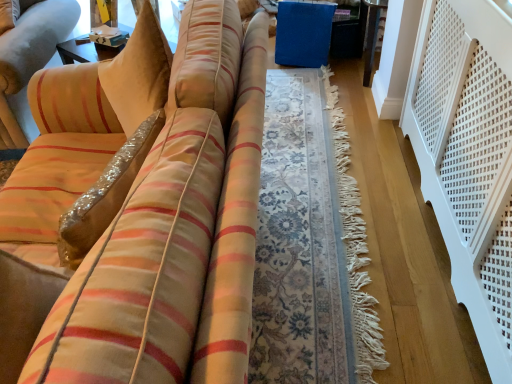
Measure the distance between point (71, 62) and camera.

7.13 feet.

Where is `white cardboard box at upper left`? This screenshot has height=384, width=512. white cardboard box at upper left is located at coordinates (90, 48).

What do you see at coordinates (90, 48) in the screenshot? This screenshot has width=512, height=384. I see `white cardboard box at upper left` at bounding box center [90, 48].

Locate an element on the screen. The height and width of the screenshot is (384, 512). white perforated balustrade at right is located at coordinates (468, 157).

Describe the element at coordinates (468, 157) in the screenshot. I see `white perforated balustrade at right` at that location.

Find the location of `white cardboard box at upper left`. white cardboard box at upper left is located at coordinates (90, 48).

Is white cardboard box at upper left to the left of white perforated balustrade at right from the viewer's perspective?

Correct, you'll find white cardboard box at upper left to the left of white perforated balustrade at right.

Considering the positions of objects white cardboard box at upper left and white perforated balustrade at right in the image provided, who is in front, white cardboard box at upper left or white perforated balustrade at right?

white perforated balustrade at right is more forward.

Between point (63, 58) and point (500, 346), which one is positioned behind?

The point (63, 58) is farther.

From the image's perspective, is white cardboard box at upper left over white perforated balustrade at right?

Yes, from the image's perspective, white cardboard box at upper left is on top of white perforated balustrade at right.

Based on the photo, from a real-world perspective, who is located lower, white cardboard box at upper left or white perforated balustrade at right?

white perforated balustrade at right.

Can you confirm if white cardboard box at upper left is wider than white perforated balustrade at right?

Incorrect, the width of white cardboard box at upper left does not surpass that of white perforated balustrade at right.

Can you confirm if white cardboard box at upper left is shorter than white perforated balustrade at right?

Yes, white cardboard box at upper left is shorter than white perforated balustrade at right.

In terms of size, does white cardboard box at upper left appear bigger or smaller than white perforated balustrade at right?

Clearly, white cardboard box at upper left is smaller in size than white perforated balustrade at right.

Would you say white cardboard box at upper left contains white perforated balustrade at right?

No, white perforated balustrade at right is not inside white cardboard box at upper left.

Is the surface of white cardboard box at upper left in direct contact with white perforated balustrade at right?

white cardboard box at upper left and white perforated balustrade at right are not in contact.

Is white cardboard box at upper left oriented towards white perforated balustrade at right?

No, white cardboard box at upper left is not turned towards white perforated balustrade at right.

Can you tell me how much white cardboard box at upper left and white perforated balustrade at right differ in facing direction?

62.9 degrees separate the facing orientations of white cardboard box at upper left and white perforated balustrade at right.

I want to click on table above the white perforated balustrade at right (from the image's perspective), so click(x=90, y=48).

Considering the positions of objects white perforated balustrade at right and white cardboard box at upper left in the image provided, who is more to the left, white perforated balustrade at right or white cardboard box at upper left?

white cardboard box at upper left is more to the left.

Is the depth of white perforated balustrade at right less than that of white cardboard box at upper left?

Yes, it is.

Considering the points (458, 44) and (83, 47), which point is behind, point (458, 44) or point (83, 47)?

Point (83, 47)

From the image's perspective, who appears lower, white perforated balustrade at right or white cardboard box at upper left?

white perforated balustrade at right, from the image's perspective.

From a real-world perspective, which object stands above the other?

In real-world perspective, white cardboard box at upper left is above.

Looking at their sizes, would you say white perforated balustrade at right is wider or thinner than white cardboard box at upper left?

white perforated balustrade at right is wider than white cardboard box at upper left.

Which of these two, white perforated balustrade at right or white cardboard box at upper left, stands taller?

white perforated balustrade at right.

Based on their sizes in the image, would you say white perforated balustrade at right is bigger or smaller than white cardboard box at upper left?

Considering their sizes, white perforated balustrade at right takes up more space than white cardboard box at upper left.

Which is correct: white perforated balustrade at right is inside white cardboard box at upper left, or outside of it?

white perforated balustrade at right cannot be found inside white cardboard box at upper left.

Is white perforated balustrade at right in contact with white cardboard box at upper left?

No, white perforated balustrade at right is not with white cardboard box at upper left.

Is white perforated balustrade at right turned away from white cardboard box at upper left?

white perforated balustrade at right does not have its back to white cardboard box at upper left.

Consider the image. How many degrees apart are the facing directions of white perforated balustrade at right and white cardboard box at upper left?

They differ by 62.9 degrees in their facing directions.

Locate an element on the screen. The height and width of the screenshot is (384, 512). table above the white perforated balustrade at right (from the image's perspective) is located at coordinates (90, 48).

This screenshot has width=512, height=384. I want to click on table on the left of white perforated balustrade at right, so click(90, 48).

You are a GUI agent. You are given a task and a screenshot of the screen. Output one action in this format:
    pyautogui.click(x=<x>, y=<y>)
    Task: Click on the table above the white perforated balustrade at right (from the image's perspective)
    
    Given the screenshot: What is the action you would take?
    pyautogui.click(x=90, y=48)